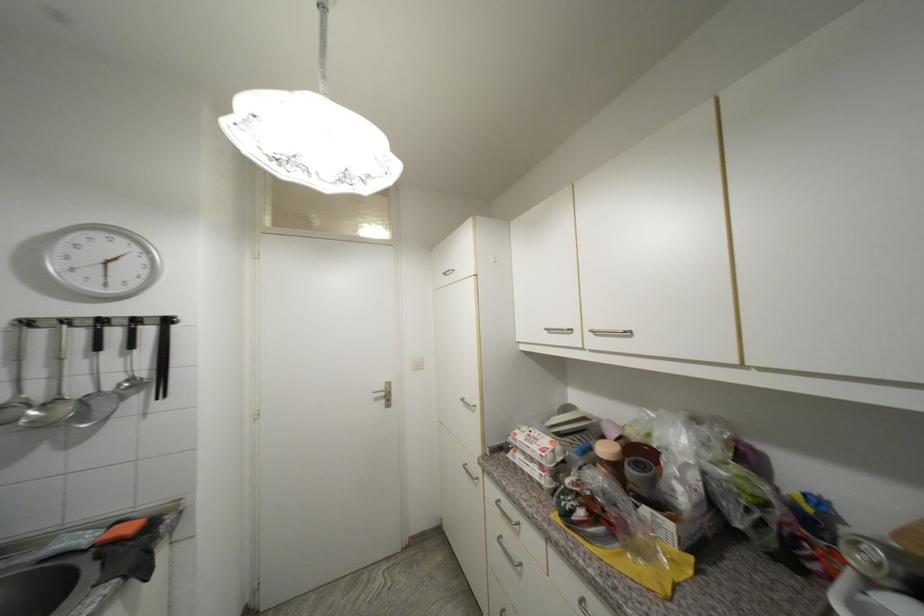
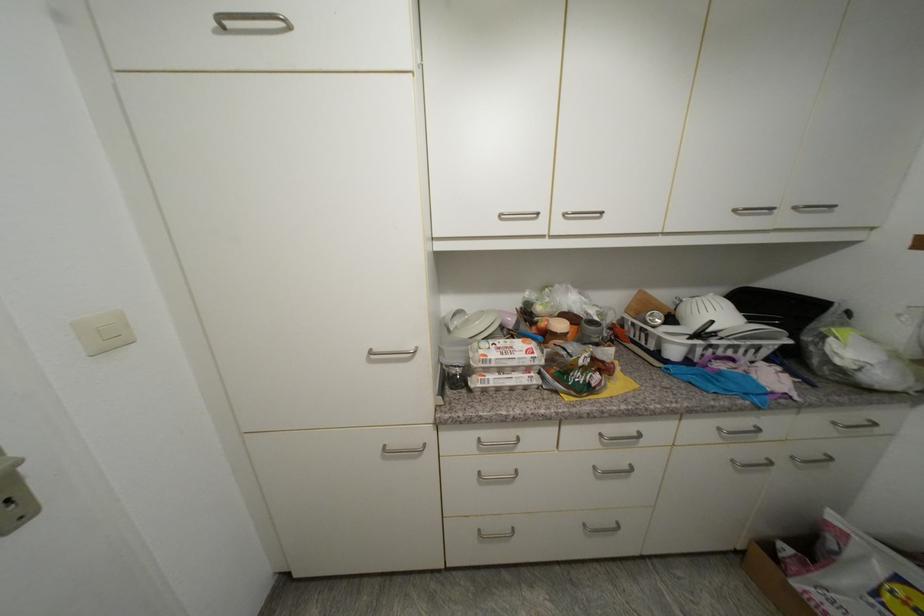
Locate, in the second image, the point that corresponds to [521,436] in the first image.

(492, 357)